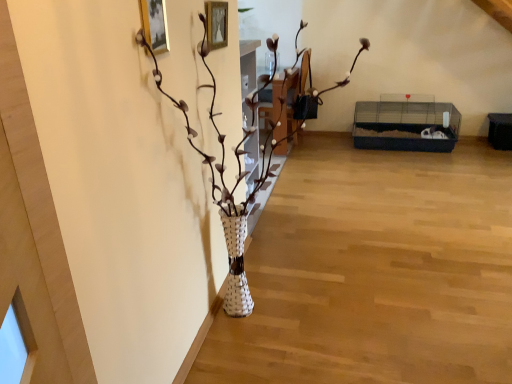
Where is `white woven vase at center`? white woven vase at center is located at coordinates (225, 186).

What do you see at coordinates (225, 186) in the screenshot? I see `white woven vase at center` at bounding box center [225, 186].

What do you see at coordinates (155, 24) in the screenshot? The image size is (512, 384). I see `metallic gold picture frame at upper left` at bounding box center [155, 24].

Locate an element on the screen. metallic gold picture frame at upper left is located at coordinates (155, 24).

The width and height of the screenshot is (512, 384). What are the coordinates of `white woven vase at center` in the screenshot? It's located at (225, 186).

Is metallic gold picture frame at upper left at the left side of white woven vase at center?

Indeed, metallic gold picture frame at upper left is positioned on the left side of white woven vase at center.

Which object is further away from the camera taking this photo, metallic gold picture frame at upper left or white woven vase at center?

metallic gold picture frame at upper left is further from the camera.

Is point (146, 10) closer or farther from the camera than point (272, 149)?

Point (146, 10) appears to be closer to the viewer than point (272, 149).

From the image's perspective, is metallic gold picture frame at upper left beneath white woven vase at center?

No, from the image's perspective, metallic gold picture frame at upper left is not below white woven vase at center.

From a real-world perspective, is metallic gold picture frame at upper left positioned above or below white woven vase at center?

Clearly, from a real-world perspective, metallic gold picture frame at upper left is above white woven vase at center.

Considering the sizes of metallic gold picture frame at upper left and white woven vase at center in the image, is metallic gold picture frame at upper left wider or thinner than white woven vase at center?

metallic gold picture frame at upper left is thinner than white woven vase at center.

Between metallic gold picture frame at upper left and white woven vase at center, which one has more height?

With more height is white woven vase at center.

Can you confirm if metallic gold picture frame at upper left is smaller than white woven vase at center?

Indeed, metallic gold picture frame at upper left has a smaller size compared to white woven vase at center.

Is metallic gold picture frame at upper left inside or outside of white woven vase at center?

metallic gold picture frame at upper left is spatially positioned inside white woven vase at center.

Based on the photo, are metallic gold picture frame at upper left and white woven vase at center far apart?

They are positioned close to each other.

Is metallic gold picture frame at upper left facing away from white woven vase at center?

Absolutely, metallic gold picture frame at upper left is directed away from white woven vase at center.

I want to click on picture frame that appears on the left of white woven vase at center, so click(x=155, y=24).

Is white woven vase at center to the left or to the right of metallic gold picture frame at upper left in the image?

Based on their positions, white woven vase at center is located to the right of metallic gold picture frame at upper left.

Does white woven vase at center come in front of metallic gold picture frame at upper left?

Yes, white woven vase at center is closer to the camera.

Between point (263, 170) and point (149, 23), which one is positioned in front?

Point (149, 23)

From the image's perspective, which is below, white woven vase at center or metallic gold picture frame at upper left?

white woven vase at center is shown below in the image.

From a real-world perspective, does white woven vase at center sit lower than metallic gold picture frame at upper left?

Yes, from a real-world perspective, white woven vase at center is below metallic gold picture frame at upper left.

Considering the sizes of white woven vase at center and metallic gold picture frame at upper left in the image, is white woven vase at center wider or thinner than metallic gold picture frame at upper left?

Considering their sizes, white woven vase at center looks broader than metallic gold picture frame at upper left.

Considering the relative sizes of white woven vase at center and metallic gold picture frame at upper left in the image provided, is white woven vase at center shorter than metallic gold picture frame at upper left?

Incorrect, the height of white woven vase at center does not fall short of that of metallic gold picture frame at upper left.

Can you confirm if white woven vase at center is smaller than metallic gold picture frame at upper left?

No.

Is metallic gold picture frame at upper left located within white woven vase at center?

Yes.

Can you see white woven vase at center touching metallic gold picture frame at upper left?

No, white woven vase at center is not touching metallic gold picture frame at upper left.

Is white woven vase at center looking in the opposite direction of metallic gold picture frame at upper left?

Yes, white woven vase at center is facing away from metallic gold picture frame at upper left.

How far apart are white woven vase at center and metallic gold picture frame at upper left?

16.64 inches.

This screenshot has height=384, width=512. I want to click on picture frame above the white woven vase at center (from a real-world perspective), so click(155, 24).

I want to click on picture frame positioned vertically above the white woven vase at center (from a real-world perspective), so click(x=155, y=24).

This screenshot has width=512, height=384. I want to click on houseplant located underneath the metallic gold picture frame at upper left (from a real-world perspective), so click(225, 186).